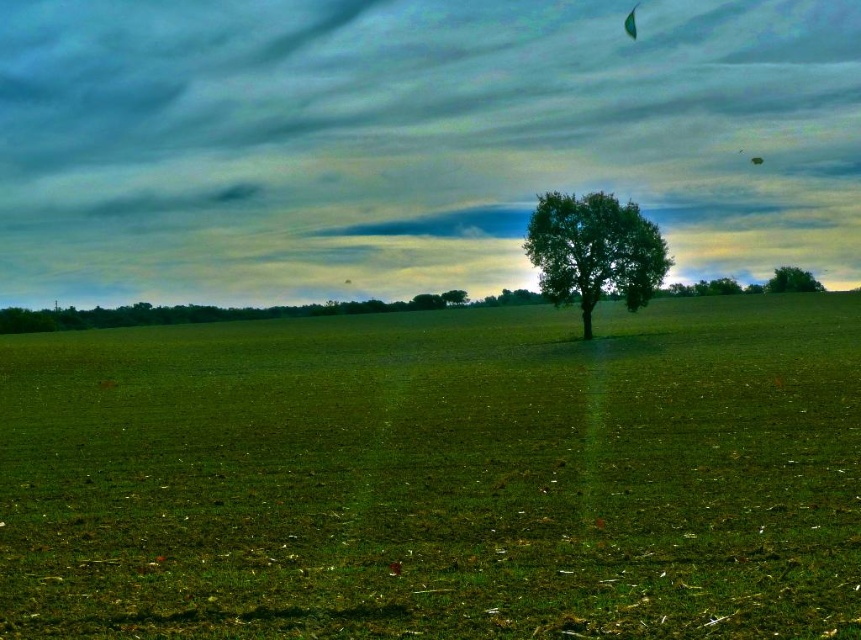
Question: Based on their relative distances, which object is nearer to the green grassy field at center?

Choices:
 (A) green leafy tree at center
 (B) green fabric parachute at upper center

Answer: (A)

Question: Does green leafy tree at center appear on the left side of green fabric parachute at upper center?

Choices:
 (A) no
 (B) yes

Answer: (B)

Question: Which of the following is the closest to the observer?

Choices:
 (A) green leafy tree at upper right
 (B) green fabric parachute at upper center
 (C) green leafy tree at center

Answer: (C)

Question: Among these objects, which one is nearest to the camera?

Choices:
 (A) green leafy tree at center
 (B) green grassy field at center
 (C) green leafy tree at upper right

Answer: (B)

Question: Can you confirm if green grassy field at center is positioned to the left of green leafy tree at center?

Choices:
 (A) no
 (B) yes

Answer: (B)

Question: Is green leafy tree at upper right thinner than green fabric parachute at upper center?

Choices:
 (A) yes
 (B) no

Answer: (B)